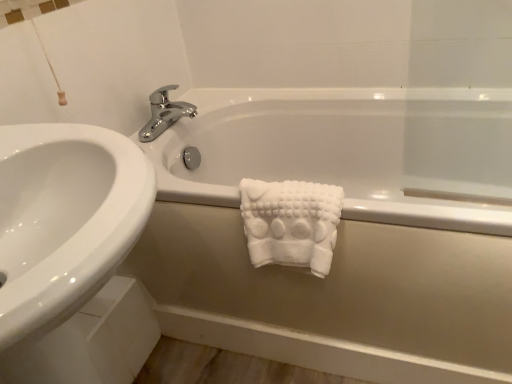
At what (x,y) coordinates should I click in order to perform the action: click on vacant location behind chrome/metallic faucet at upper center. Please return your answer as a coordinate pair (x, y). Image resolution: width=512 pixels, height=384 pixels. Looking at the image, I should click on click(x=199, y=98).